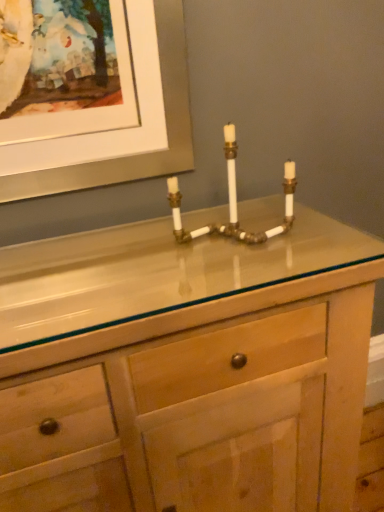
Where is `natural wood cabinet at center`? The width and height of the screenshot is (384, 512). natural wood cabinet at center is located at coordinates (195, 356).

The height and width of the screenshot is (512, 384). What do you see at coordinates (195, 356) in the screenshot?
I see `natural wood cabinet at center` at bounding box center [195, 356].

Locate an element on the screen. The height and width of the screenshot is (512, 384). brass/bronze pipe at center is located at coordinates (233, 201).

Describe the element at coordinates (233, 201) in the screenshot. I see `brass/bronze pipe at center` at that location.

Locate an element on the screen. natural wood cabinet at center is located at coordinates (195, 356).

Can you confirm if natural wood cabinet at center is positioned to the right of brass/bronze pipe at center?

No.

Is natural wood cabinet at center closer to camera compared to brass/bronze pipe at center?

Yes, the depth of natural wood cabinet at center is less than that of brass/bronze pipe at center.

Between point (192, 286) and point (293, 163), which one is positioned behind?

Point (293, 163)

From the image's perspective, would you say natural wood cabinet at center is shown under brass/bronze pipe at center?

Correct, natural wood cabinet at center appears lower than brass/bronze pipe at center in the image.

Looking at this image, from a real-world perspective, is natural wood cabinet at center above or below brass/bronze pipe at center?

From a real-world perspective, natural wood cabinet at center is physically below brass/bronze pipe at center.

Between natural wood cabinet at center and brass/bronze pipe at center, which one has larger width?

natural wood cabinet at center.

Considering the sizes of objects natural wood cabinet at center and brass/bronze pipe at center in the image provided, who is shorter, natural wood cabinet at center or brass/bronze pipe at center?

With less height is brass/bronze pipe at center.

Can you confirm if natural wood cabinet at center is smaller than brass/bronze pipe at center?

Actually, natural wood cabinet at center might be larger than brass/bronze pipe at center.

Is brass/bronze pipe at center completely or partially inside natural wood cabinet at center?

No, brass/bronze pipe at center is not inside natural wood cabinet at center.

Is natural wood cabinet at center positioned far away from brass/bronze pipe at center?

No, there isn't a large distance between natural wood cabinet at center and brass/bronze pipe at center.

Is brass/bronze pipe at center at the back of natural wood cabinet at center?

No, brass/bronze pipe at center is not at the back of natural wood cabinet at center.

How far apart are natural wood cabinet at center and brass/bronze pipe at center?

The distance of natural wood cabinet at center from brass/bronze pipe at center is 11.58 inches.

The image size is (384, 512). What are the coordinates of `candle holder behind the natural wood cabinet at center` in the screenshot? It's located at (233, 201).

Visually, is brass/bronze pipe at center positioned to the left or to the right of natural wood cabinet at center?

From the image, it's evident that brass/bronze pipe at center is to the right of natural wood cabinet at center.

Is the position of brass/bronze pipe at center less distant than that of natural wood cabinet at center?

No, it is not.

Which is closer to the camera, [189,239] or [189,443]?

Point [189,239] is positioned farther from the camera compared to point [189,443].

Looking at this image, from the image's perspective, relative to natural wood cabinet at center, is brass/bronze pipe at center above or below?

brass/bronze pipe at center is situated higher than natural wood cabinet at center in the image.

Based on the photo, from a real-world perspective, between brass/bronze pipe at center and natural wood cabinet at center, who is vertically lower?

natural wood cabinet at center.

Considering the relative sizes of brass/bronze pipe at center and natural wood cabinet at center in the image provided, is brass/bronze pipe at center wider than natural wood cabinet at center?

No.

Does brass/bronze pipe at center have a greater height compared to natural wood cabinet at center?

No.

Considering the sizes of objects brass/bronze pipe at center and natural wood cabinet at center in the image provided, who is smaller, brass/bronze pipe at center or natural wood cabinet at center?

brass/bronze pipe at center.

Is brass/bronze pipe at center not inside natural wood cabinet at center?

Yes, brass/bronze pipe at center is outside of natural wood cabinet at center.

Can you see brass/bronze pipe at center touching natural wood cabinet at center?

There is a gap between brass/bronze pipe at center and natural wood cabinet at center.

In the scene shown: Is brass/bronze pipe at center turned away from natural wood cabinet at center?

No, brass/bronze pipe at center's orientation is not away from natural wood cabinet at center.

Where is `the chest of drawers below the brass/bronze pipe at center (from a real-world perspective)`? the chest of drawers below the brass/bronze pipe at center (from a real-world perspective) is located at coordinates coord(195,356).

The height and width of the screenshot is (512, 384). In order to click on candle holder located above the natural wood cabinet at center (from a real-world perspective) in this screenshot , I will do `click(233, 201)`.

The height and width of the screenshot is (512, 384). Find the location of `chest of drawers in front of the brass/bronze pipe at center`. chest of drawers in front of the brass/bronze pipe at center is located at coordinates (195, 356).